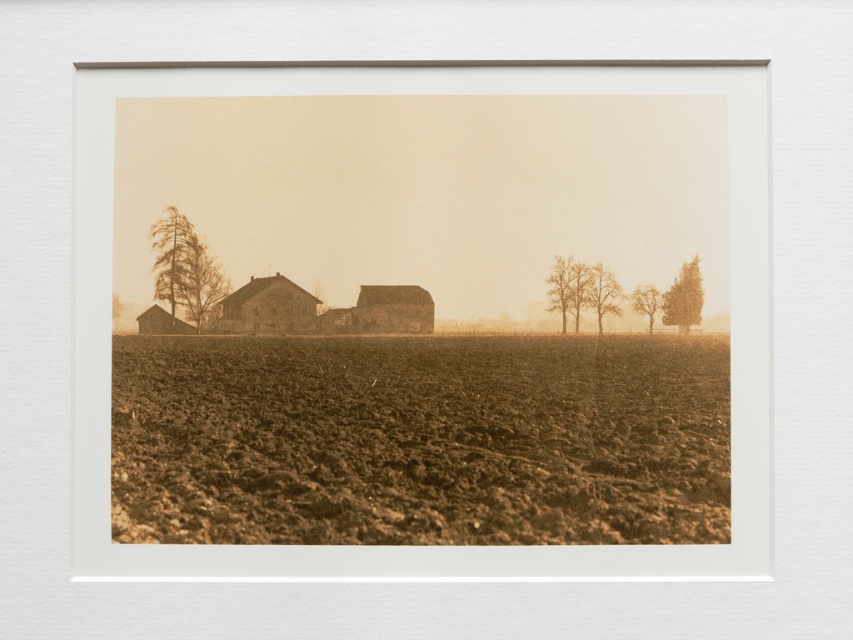
Does brown soil at center have a lesser height compared to smooth bark tree at center?

No.

Who is positioned more to the right, brown soil at center or smooth bark tree at center?

Positioned to the right is smooth bark tree at center.

You are a GUI agent. You are given a task and a screenshot of the screen. Output one action in this format:
    pyautogui.click(x=<x>, y=<y>)
    Task: Click on the brown soil at center
    This screenshot has height=640, width=853.
    Given the screenshot: What is the action you would take?
    pyautogui.click(x=421, y=440)

This screenshot has width=853, height=640. In order to click on brown soil at center in this screenshot , I will do `click(421, 440)`.

Can you confirm if brown soil at center is positioned above smooth brown tree at right?

No, brown soil at center is not above smooth brown tree at right.

Image resolution: width=853 pixels, height=640 pixels. What do you see at coordinates (421, 440) in the screenshot? I see `brown soil at center` at bounding box center [421, 440].

Image resolution: width=853 pixels, height=640 pixels. What are the coordinates of `brown soil at center` in the screenshot? It's located at (421, 440).

Does point (181, 301) come in front of point (643, 288)?

No, it is not.

Is sepia textured tree at left above smooth brown tree at right?

Yes.

This screenshot has height=640, width=853. I want to click on sepia textured tree at left, so click(x=173, y=259).